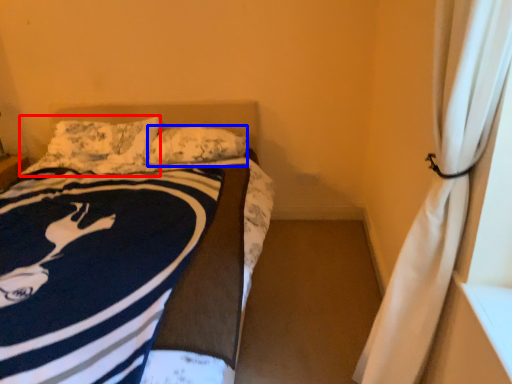
Question: Which object appears closest to the camera in this image, pillow (highlighted by a red box) or pillow (highlighted by a blue box)?

Choices:
 (A) pillow
 (B) pillow

Answer: (B)